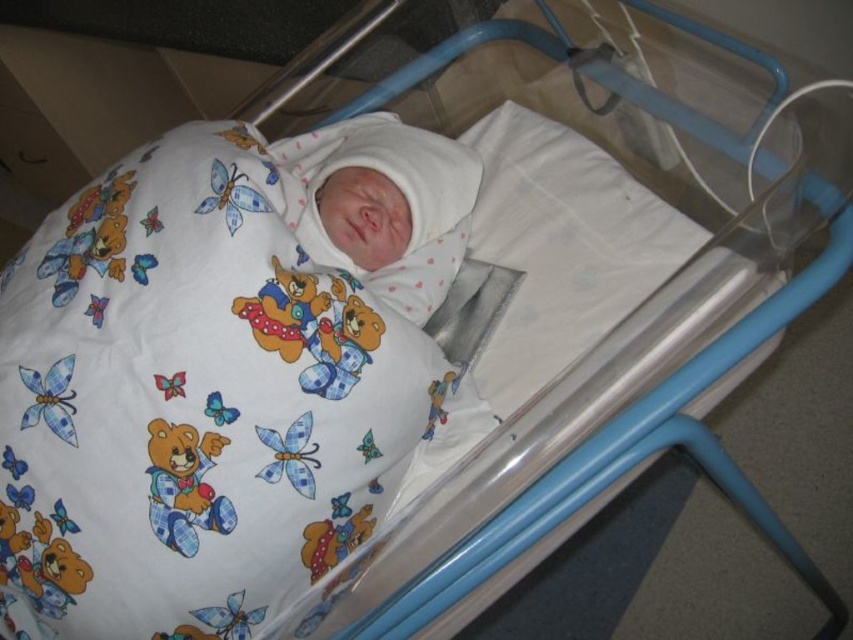
You are a nurse in a hospital nursery. You need to place a small medical kit on the white fabric with teddy bear print at center. The medical kit has a width of 12 cm. Can you determine if the area at point (218, 376) has enough space to accommodate the medical kit without overlapping other objects?

The point (218, 376) is on the white fabric with teddy bear print at center, which is part of the swaddling blanket. Since the fabric is the main covering for the baby, placing a 12 cm wide medical kit there might interfere with the baby. Please choose a different location.

You are a nurse checking the hospital bassinet. Where is the white fabric with teddy bear print at center positioned in relation to the bassinet?

The white fabric with teddy bear print at center is positioned at coordinates point [218,376] within the bassinet.

You are a nurse in a hospital nursery. You need to place a small medical kit on the bassinet frame so that it is within arm reach of the newborn baby. The medical kit must be placed exactly at point (x=225, y=467). Given that the nurse can reach up to 28 inches, will the medical kit be within reach?

The point (x=225, y=467) is 27.67 inches away from the viewer, so yes, the medical kit placed at point (x=225, y=467) will be within the nurse s 28 inches reach.